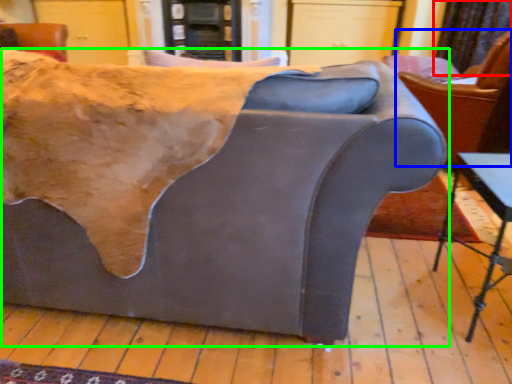
Question: Which object is the closest to the curtain (highlighted by a red box)? Choose among these: chair (highlighted by a blue box) or studio couch (highlighted by a green box).

Choices:
 (A) chair
 (B) studio couch

Answer: (A)